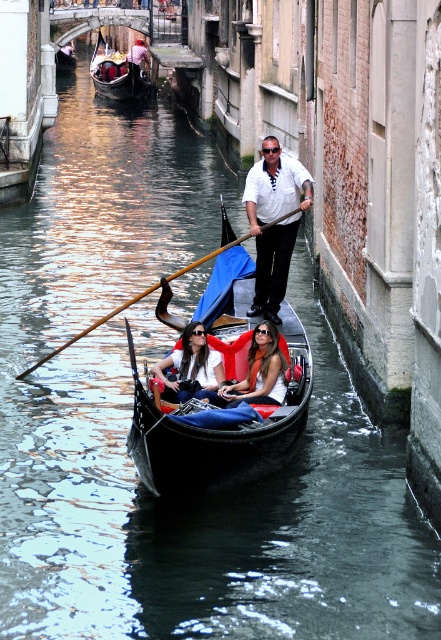
Question: Is black polished gondola at center bigger than wooden gondola at center?

Choices:
 (A) yes
 (B) no

Answer: (B)

Question: Does black polished gondola at center appear over matte black sunglasses at center?

Choices:
 (A) yes
 (B) no

Answer: (A)

Question: From the image, what is the correct spatial relationship of black polished gondola at center in relation to matte black gondola at center?

Choices:
 (A) right
 (B) left

Answer: (A)

Question: Among these points, which one is nearest to the camera?

Choices:
 (A) (159, 362)
 (B) (291, 250)
 (C) (208, 388)

Answer: (C)

Question: Which is nearer to the black polished gondola at center?

Choices:
 (A) matte black gondola at center
 (B) matte black sunglasses at center
 (C) white striped shirt at center
 (D) wooden gondola at center

Answer: (B)

Question: Based on their relative distances, which object is nearer to the white striped shirt at center?

Choices:
 (A) black polished gondola at center
 (B) wooden gondola at center
 (C) matte black gondola at center
 (D) matte black sunglasses at center

Answer: (A)